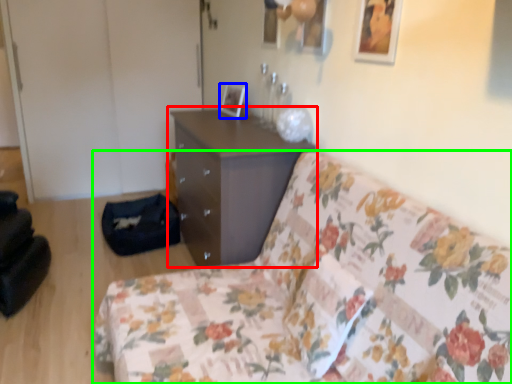
Question: Which object is the farthest from chest of drawers (highlighted by a red box)? Choose among these: picture frame (highlighted by a blue box) or studio couch (highlighted by a green box).

Choices:
 (A) picture frame
 (B) studio couch

Answer: (B)